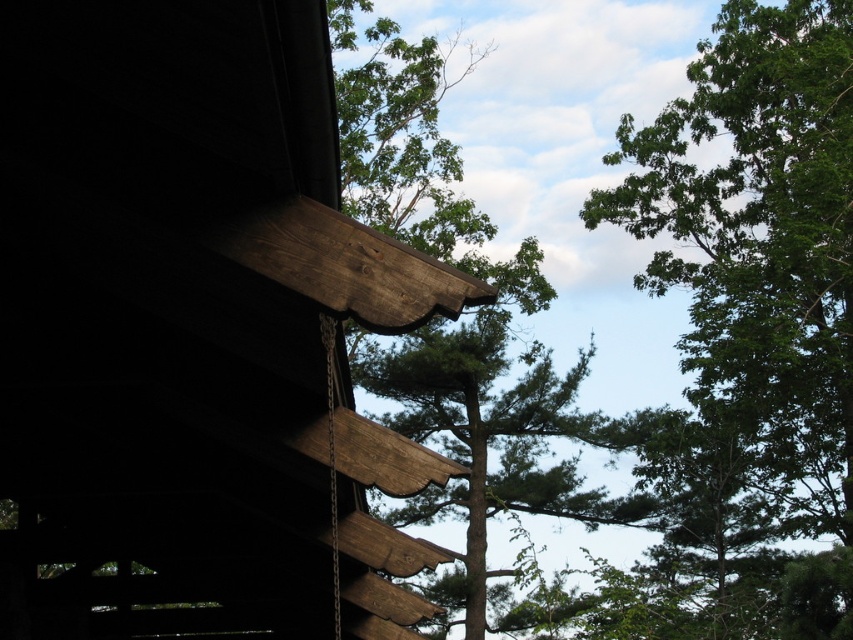
Question: Which point is farther to the camera?

Choices:
 (A) dark brown wood cabin at upper left
 (B) green leafy tree at upper right

Answer: (B)

Question: Among these objects, which one is farthest from the camera?

Choices:
 (A) green leafy tree at upper right
 (B) dark brown wood cabin at upper left

Answer: (A)

Question: Is dark brown wood cabin at upper left thinner than green leafy tree at upper right?

Choices:
 (A) yes
 (B) no

Answer: (A)

Question: Can you confirm if dark brown wood cabin at upper left is positioned below green leafy tree at upper right?

Choices:
 (A) no
 (B) yes

Answer: (B)

Question: From the image, what is the correct spatial relationship of dark brown wood cabin at upper left in relation to green leafy tree at upper right?

Choices:
 (A) below
 (B) above

Answer: (A)